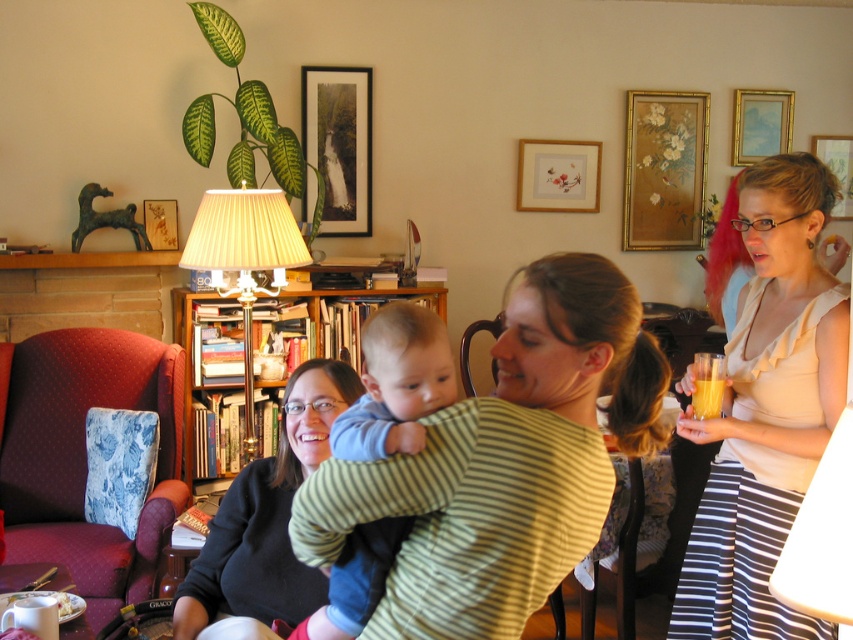
You are a photographer setting up a shoot in this living room. You need to place a small prop between the black sweater at center and the wooden picture frame at upper center. To ensure the prop is visible in the final photo, where should you position it relative to these two objects?

The prop should be placed closer to the black sweater at center since it is closer to the viewer than the wooden picture frame at upper center, ensuring visibility in the photo.

You are organizing a photo shoot in this living room and need to position a new decorative item on the wall. The item must be placed above the black sweater at center but below the gold metallic picture frame at upper right. Is there enough vertical space between these two objects to accommodate the new item?

The black sweater at center is located below the gold metallic picture frame at upper right, so there is vertical space between them. Therefore, the new decorative item can be placed in that space above the black sweater at center but below the gold metallic picture frame at upper right.

Looking at this image, you are a photographer setting up a tripod in this living room. You need to place the tripod so that both the black sweater at center and the gold metallic picture frame at upper right are visible in the shot. Which object should you position closer to the front of the frame to ensure both are in view?

The black sweater at center is much taller than the gold metallic picture frame at upper right, so positioning the taller black sweater at center closer to the front of the frame will help ensure both objects remain visible in the shot without one blocking the other.